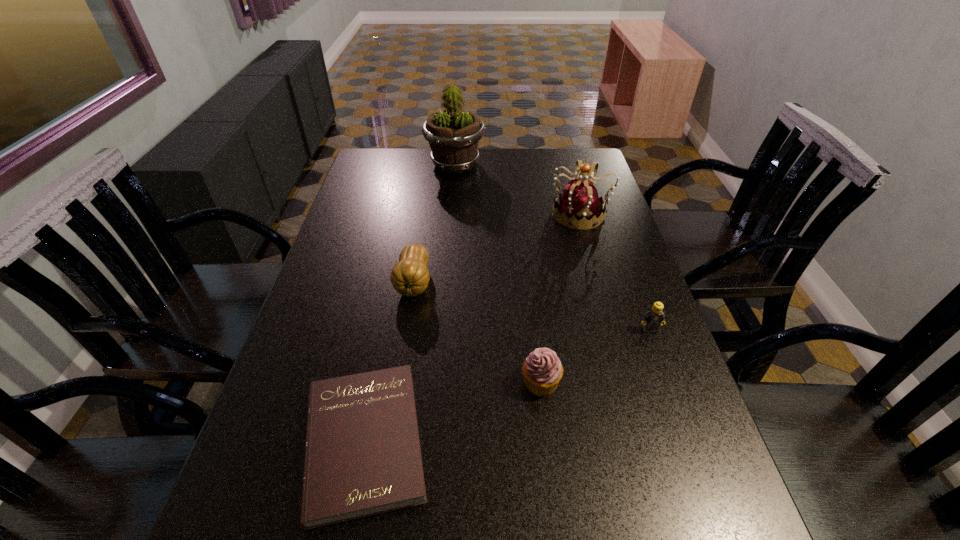
In order to click on flowerpot in this screenshot , I will do `click(453, 135)`.

At what (x,y) coordinates should I click in order to perform the action: click on the farthest object. Please return your answer as a coordinate pair (x, y). The height and width of the screenshot is (540, 960). Looking at the image, I should click on (453, 135).

Find the location of a particular element. the second tallest object is located at coordinates (580, 204).

This screenshot has height=540, width=960. Find the location of `the fifth nearest object`. the fifth nearest object is located at coordinates (580, 204).

Where is `cupcake`? This screenshot has height=540, width=960. cupcake is located at coordinates click(542, 370).

This screenshot has width=960, height=540. Identify the location of gourd. (410, 276).

Where is `Lego`? Lego is located at coordinates (654, 317).

Where is `the shortest object`? The height and width of the screenshot is (540, 960). the shortest object is located at coordinates (362, 457).

In order to click on free location located 0.090m on the front of the flowerpot in this screenshot , I will do `click(453, 193)`.

I want to click on free space located on the front-facing side of the fifth nearest object, so click(x=500, y=214).